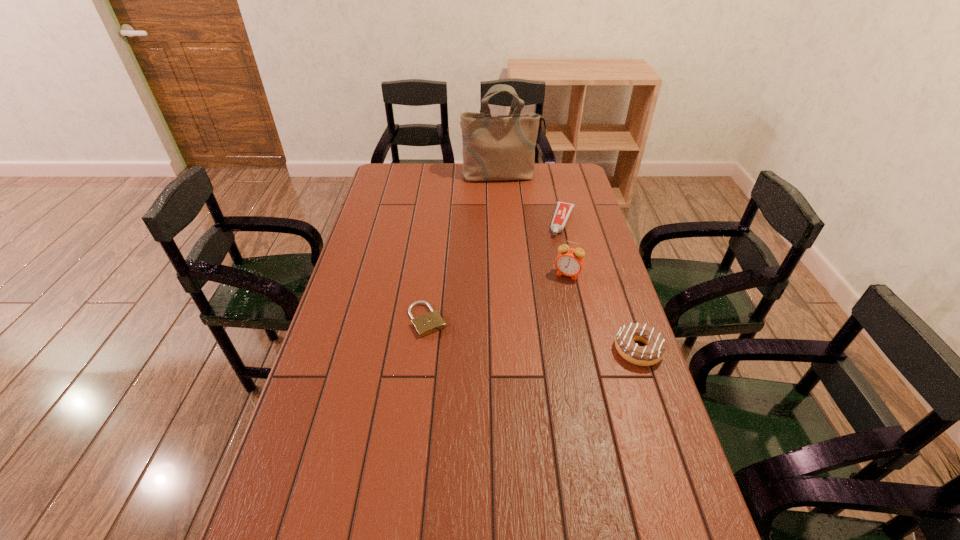
The width and height of the screenshot is (960, 540). Identify the location of vacant region located 0.330m at the nozzle of the toothpaste. (541, 295).

Locate an element on the screen. This screenshot has height=540, width=960. object present at the far edge is located at coordinates (495, 147).

You are a GUI agent. You are given a task and a screenshot of the screen. Output one action in this format:
    pyautogui.click(x=<x>, y=<y>)
    Task: Click on the doughnut that is at the right edge
    This screenshot has width=960, height=540.
    Given the screenshot: What is the action you would take?
    pyautogui.click(x=654, y=351)

Identify the location of alarm clock at the right edge. This screenshot has height=540, width=960. pos(569,262).

Locate an element on the screen. This screenshot has width=960, height=540. toothpaste that is at the right edge is located at coordinates (563, 210).

The image size is (960, 540). What are the coordinates of `free point at the far edge` in the screenshot? It's located at pos(418,170).

Where is `vacant space at the left edge of the desktop`? vacant space at the left edge of the desktop is located at coordinates (396, 225).

Identify the location of vacant space at the right edge of the desktop. The width and height of the screenshot is (960, 540). (600, 244).

Where is `free space at the far right corner of the desktop`? free space at the far right corner of the desktop is located at coordinates (585, 187).

Find the location of a particular element. vacant space that's between the farthest object and the toothpaste is located at coordinates [x=532, y=199].